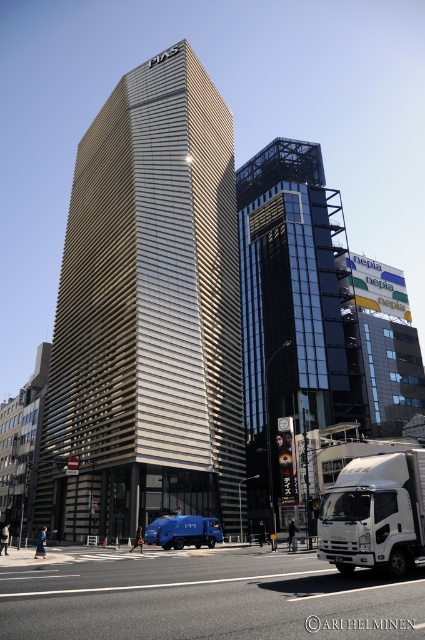
Measure the distance between white glossy trailer truck at lower right and blue matte truck at lower center.

white glossy trailer truck at lower right is 36.15 meters away from blue matte truck at lower center.

Is white glossy trailer truck at lower right positioned in front of blue matte truck at lower center?

Yes, white glossy trailer truck at lower right is closer to the viewer.

Is point (340, 552) more distant than point (193, 544)?

That is False.

Identify the location of white glossy trailer truck at lower right. (374, 513).

Who is more distant from viewer, (195,280) or (167,538)?

The point (195,280) is behind.

How much distance is there between metallic silver skyscraper at center and blue matte truck at lower center?

metallic silver skyscraper at center and blue matte truck at lower center are 31.86 meters apart from each other.

Find the location of a particular element. Image resolution: width=425 pixels, height=640 pixels. metallic silver skyscraper at center is located at coordinates (147, 312).

Is glassy steel tower at center bigger than white glossy trailer truck at lower right?

Yes, glassy steel tower at center is bigger than white glossy trailer truck at lower right.

Where is `glassy steel tower at center`? The width and height of the screenshot is (425, 640). glassy steel tower at center is located at coordinates (292, 310).

You are a GUI agent. You are given a task and a screenshot of the screen. Output one action in this format:
    pyautogui.click(x=<x>, y=<y>)
    Task: Click on the glassy steel tower at center
    Image resolution: width=425 pixels, height=640 pixels.
    Given the screenshot: What is the action you would take?
    pyautogui.click(x=292, y=310)